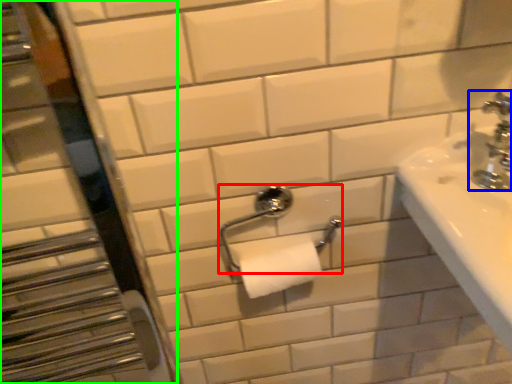
Question: Estimate the real-world distances between objects in this image. Which object is closer to towel bar (highlighted by a red box), tap (highlighted by a blue box) or mirror (highlighted by a green box)?

Choices:
 (A) tap
 (B) mirror

Answer: (A)